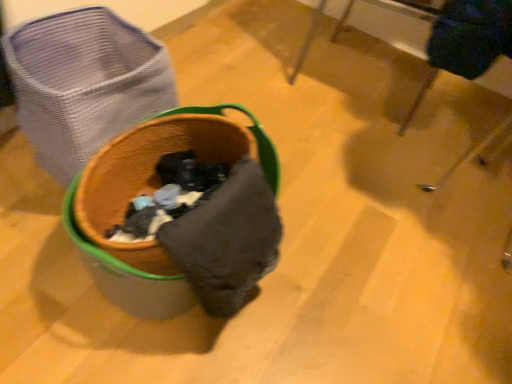
This screenshot has height=384, width=512. I want to click on free spot in front of wooden table at upper center, so click(x=364, y=150).